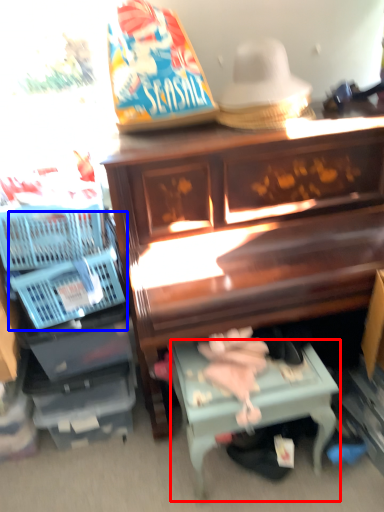
Question: Among these objects, which one is farthest to the camera, table (highlighted by a red box) or basket (highlighted by a blue box)?

Choices:
 (A) table
 (B) basket

Answer: (B)